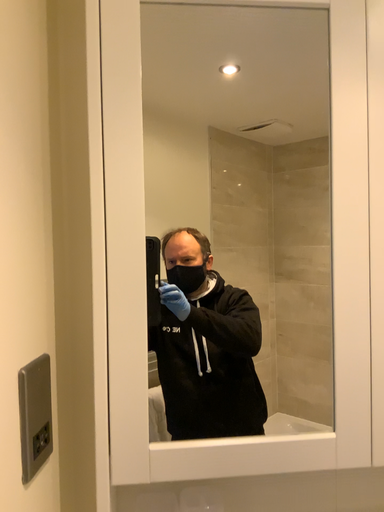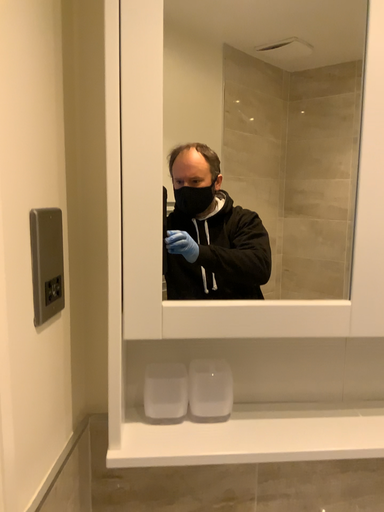
Question: Which way did the camera rotate in the video?

Choices:
 (A) rotated upward
 (B) rotated downward

Answer: (B)